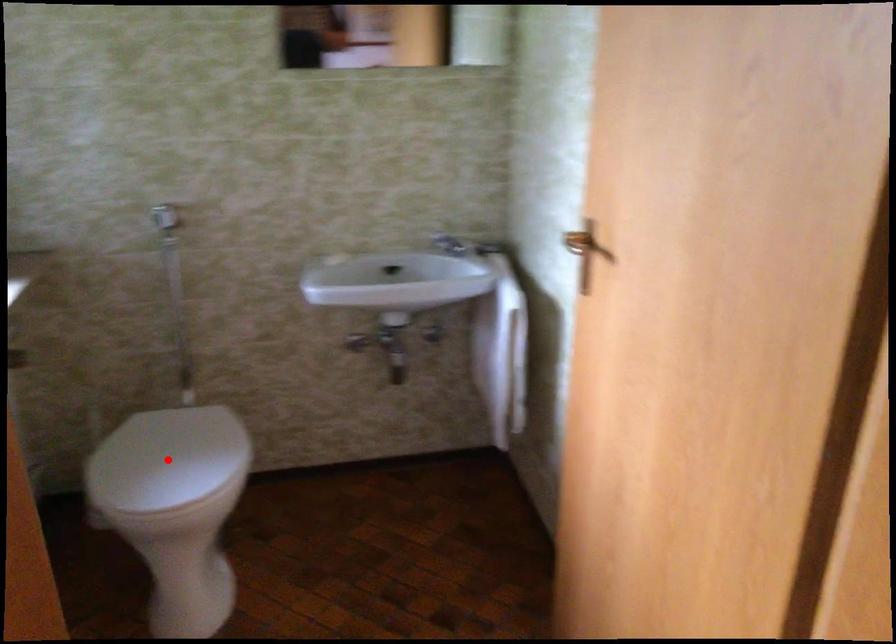
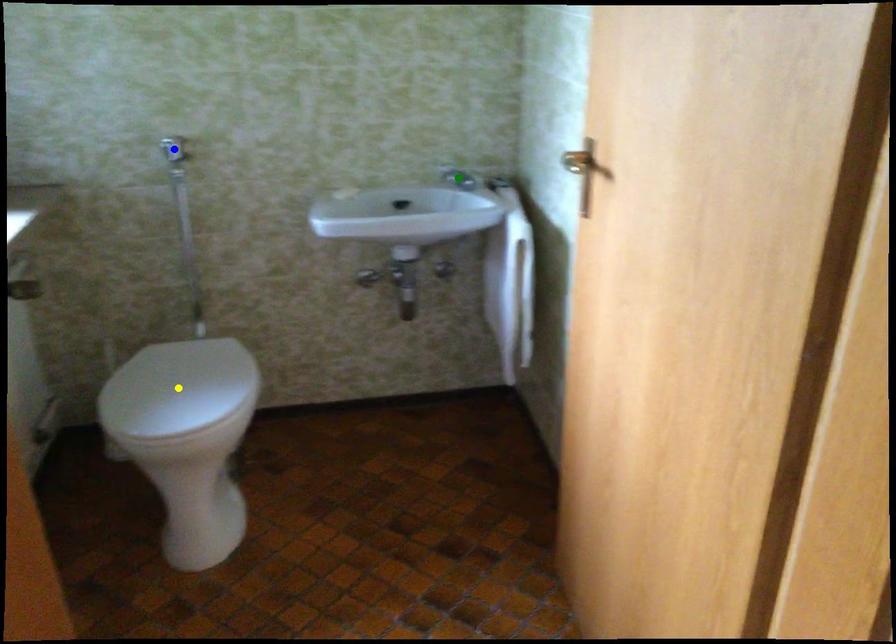
Question: I am providing you with two images of the same scene from different viewpoints. A red point is marked on the first image. You are given multiple points on the second image. Can you choose the point in image 2 that corresponds to the point in image 1?

Choices:
 (A) yellow point
 (B) green point
 (C) blue point

Answer: (A)